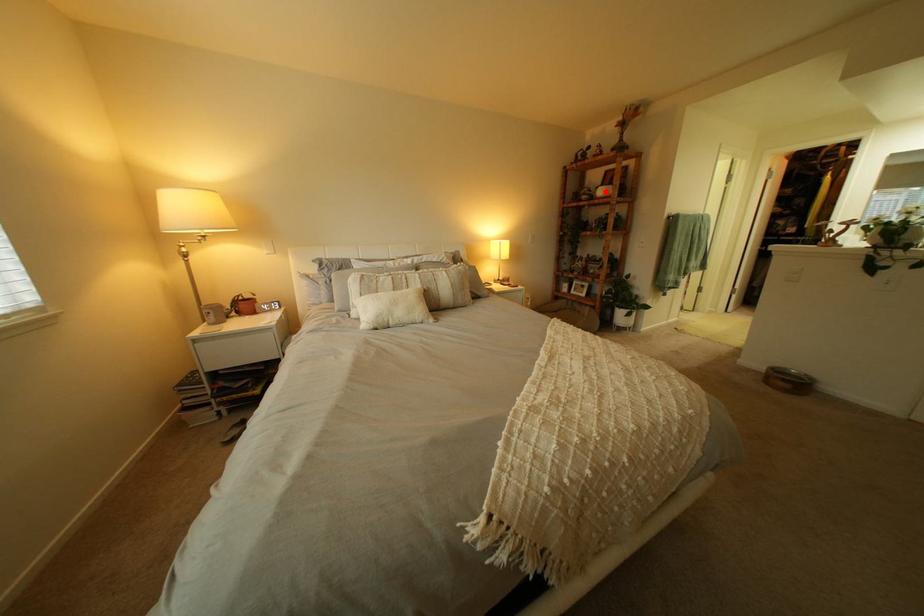
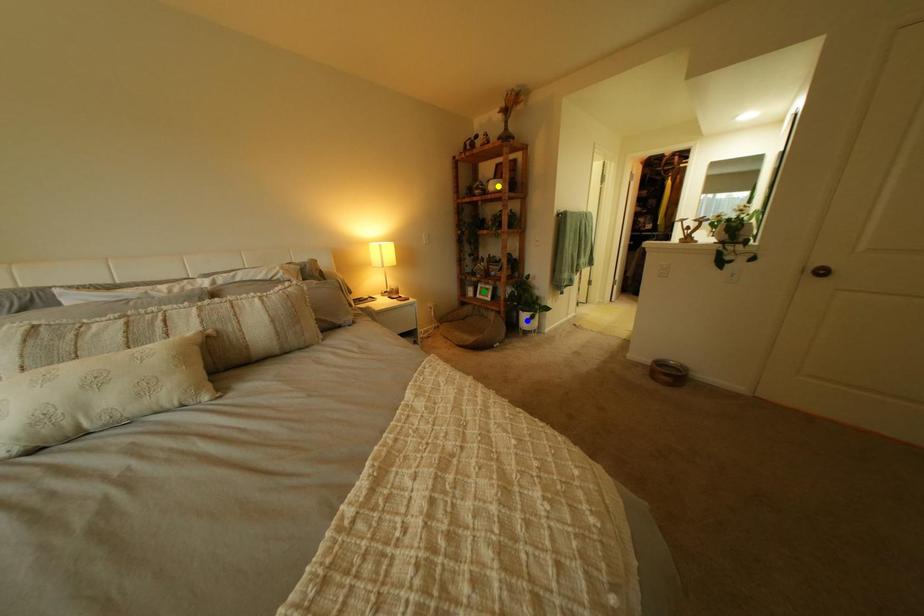
Question: I am providing you with two images of the same scene from different viewpoints. A red point is marked on the first image. You are given multiple points on the second image. Can you choose the point in image 2 that corresponds to the point in image 1?

Choices:
 (A) green point
 (B) blue point
 (C) yellow point

Answer: (C)